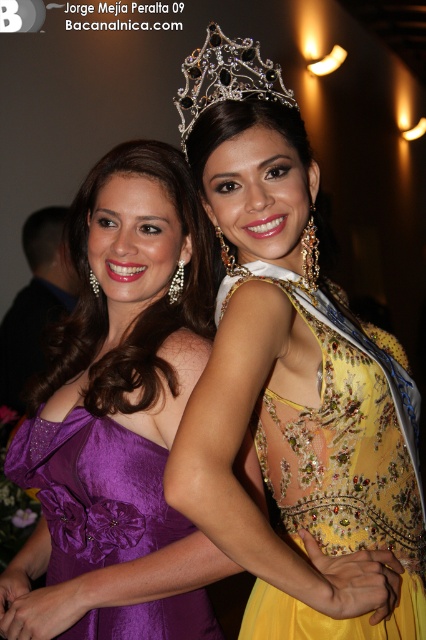
Locate an element on the screen. The height and width of the screenshot is (640, 426). purple satin dress at center is located at coordinates point(118,416).

Is point (89, 522) less distant than point (256, 262)?

No, (89, 522) is further to viewer.

Where is `purple satin dress at center`? The height and width of the screenshot is (640, 426). purple satin dress at center is located at coordinates (118, 416).

I want to click on purple satin dress at center, so click(118, 416).

Is point (417, 632) farther from camera compared to point (192, 100)?

No, (417, 632) is closer to viewer.

Can you confirm if yellow beaded dress at center is thinner than diamond encrusted tiara at upper center?

Incorrect, yellow beaded dress at center's width is not less than diamond encrusted tiara at upper center's.

Does point (279, 493) come farther from viewer compared to point (224, 40)?

That is True.

Locate an element on the screen. The height and width of the screenshot is (640, 426). yellow beaded dress at center is located at coordinates (340, 467).

Who is taller, matte gold dress at center or purple satin dress at left?

With more height is matte gold dress at center.

What do you see at coordinates (293, 381) in the screenshot? This screenshot has width=426, height=640. I see `matte gold dress at center` at bounding box center [293, 381].

Find the location of a particular element. Image resolution: width=426 pixels, height=640 pixels. matte gold dress at center is located at coordinates (293, 381).